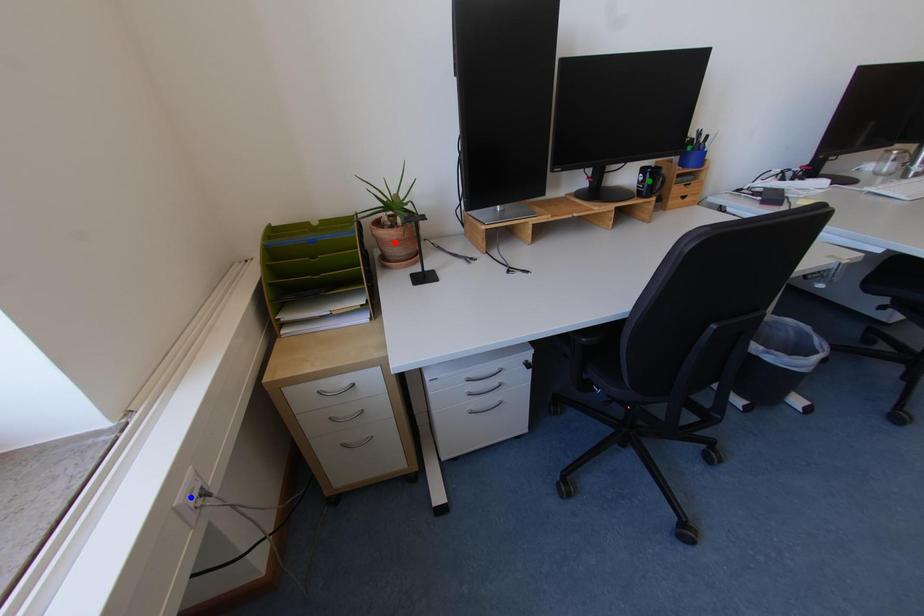
Order these from nearest to farthest:
1. blue point
2. green point
3. red point

blue point
red point
green point